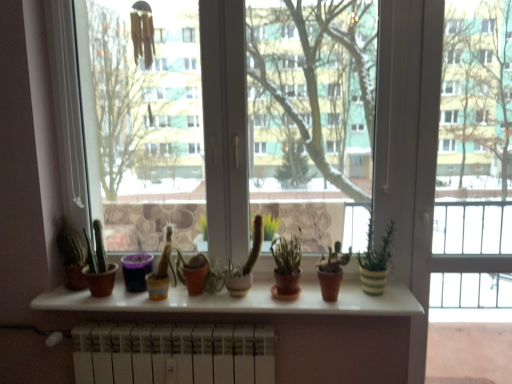
Question: Is the depth of matte terracotta pot at center, the 1th flowerpot from the right, greater than that of terracotta clay pot at center, which ranks as the second houseplant in right-to-left order?

Choices:
 (A) yes
 (B) no

Answer: (A)

Question: Is matte terracotta pot at center, the 2th flowerpot when ordered from left to right, positioned beyond the bounds of terracotta clay pot at center, which ranks as the second houseplant in right-to-left order?

Choices:
 (A) no
 (B) yes

Answer: (B)

Question: From the image's perspective, does matte terracotta pot at center, the 2th flowerpot when ordered from left to right, appear lower than terracotta clay pot at center, which ranks as the second houseplant in right-to-left order?

Choices:
 (A) no
 (B) yes

Answer: (B)

Question: Considering the relative sizes of matte terracotta pot at center, the 1th flowerpot from the right, and terracotta clay pot at center, which is the 5th houseplant from left to right, in the image provided, is matte terracotta pot at center, the 1th flowerpot from the right, shorter than terracotta clay pot at center, which is the 5th houseplant from left to right,?

Choices:
 (A) no
 (B) yes

Answer: (B)

Question: Is matte terracotta pot at center, the 1th flowerpot from the right, at the left side of terracotta clay pot at center, which is the 5th houseplant from left to right?

Choices:
 (A) yes
 (B) no

Answer: (A)

Question: Looking at their shapes, would you say purple matte flowerpot at center, the second flowerpot viewed from the right, is wider or thinner than green striped pot at right, positioned as the first houseplant in right-to-left order?

Choices:
 (A) wide
 (B) thin

Answer: (B)

Question: From their relative heights in the image, would you say purple matte flowerpot at center, the second flowerpot viewed from the right, is taller or shorter than green striped pot at right, marked as the 6th houseplant in a left-to-right arrangement?

Choices:
 (A) tall
 (B) short

Answer: (B)

Question: In terms of size, does purple matte flowerpot at center, which ranks as the first flowerpot in left-to-right order, appear bigger or smaller than green striped pot at right, marked as the 6th houseplant in a left-to-right arrangement?

Choices:
 (A) small
 (B) big

Answer: (A)

Question: Would you say purple matte flowerpot at center, which ranks as the first flowerpot in left-to-right order, is to the left or to the right of green striped pot at right, positioned as the first houseplant in right-to-left order, in the picture?

Choices:
 (A) left
 (B) right

Answer: (A)

Question: Is point (121, 258) closer or farther from the camera than point (273, 256)?

Choices:
 (A) farther
 (B) closer

Answer: (A)

Question: Considering the positions of purple matte flowerpot at center, the second flowerpot viewed from the right, and green matte cactus at center, which is the 3th houseplant from right to left, in the image, is purple matte flowerpot at center, the second flowerpot viewed from the right, wider or thinner than green matte cactus at center, which is the 3th houseplant from right to left,?

Choices:
 (A) thin
 (B) wide

Answer: (A)

Question: Is purple matte flowerpot at center, which ranks as the first flowerpot in left-to-right order, inside the boundaries of green matte cactus at center, which is the 3th houseplant from right to left, or outside?

Choices:
 (A) outside
 (B) inside

Answer: (A)

Question: Would you say purple matte flowerpot at center, which ranks as the first flowerpot in left-to-right order, is to the left or to the right of green matte cactus at center, the fourth houseplant in the left-to-right sequence, in the picture?

Choices:
 (A) right
 (B) left

Answer: (B)

Question: Is point (350, 256) closer or farther from the camera than point (72, 258)?

Choices:
 (A) closer
 (B) farther

Answer: (A)

Question: Considering the positions of terracotta clay pot at center, which is the 5th houseplant from left to right, and matte brown cactus at left, acting as the 1th houseplant starting from the left, in the image, is terracotta clay pot at center, which is the 5th houseplant from left to right, taller or shorter than matte brown cactus at left, acting as the 1th houseplant starting from the left,?

Choices:
 (A) short
 (B) tall

Answer: (A)